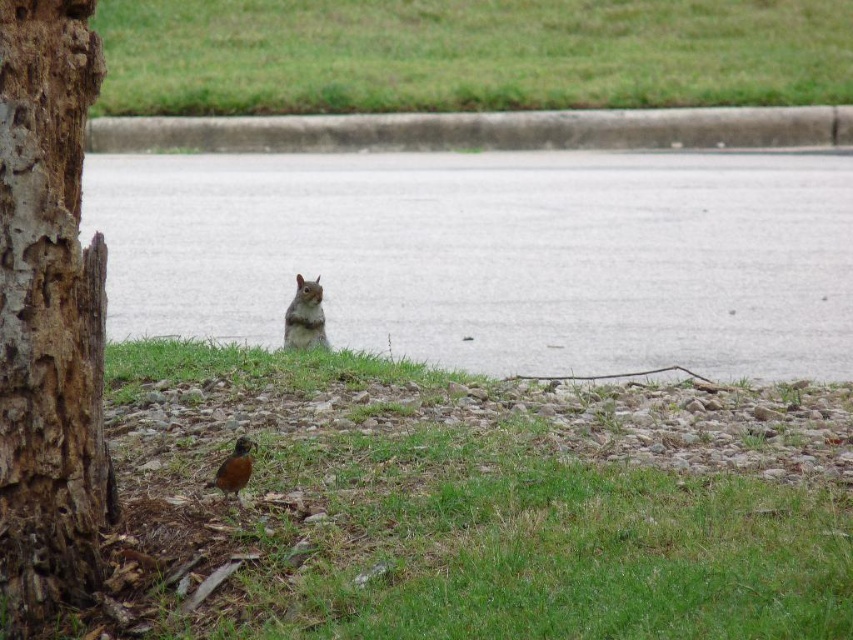
Question: Among these objects, which one is nearest to the camera?

Choices:
 (A) green grass at lower center
 (B) brown rough bark tree trunk at left
 (C) green grass at upper center
 (D) gray fur squirrel at center

Answer: (B)

Question: Is concrete curb at upper center to the left of gray furry squirrel at center from the viewer's perspective?

Choices:
 (A) no
 (B) yes

Answer: (B)

Question: Does brown rough bark tree trunk at left have a lesser width compared to concrete curb at upper center?

Choices:
 (A) no
 (B) yes

Answer: (B)

Question: Which is farther from the green grass at upper center?

Choices:
 (A) concrete curb at upper center
 (B) brown rough bark tree trunk at left
 (C) green grass at lower center
 (D) gray furry squirrel at center

Answer: (C)

Question: Can you confirm if gray furry squirrel at center is wider than gray fur squirrel at center?

Choices:
 (A) yes
 (B) no

Answer: (A)

Question: Among these objects, which one is nearest to the camera?

Choices:
 (A) green grass at lower center
 (B) gray fur squirrel at center

Answer: (A)